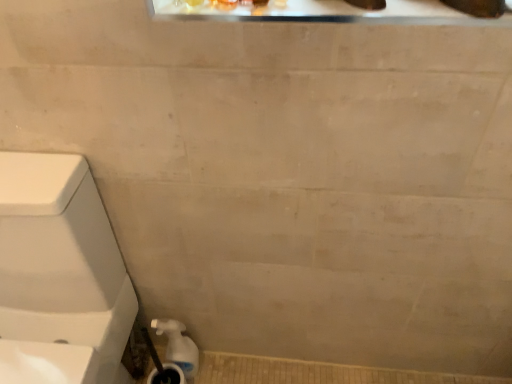
Question: Is white glossy water pipe at lower left aimed at white glossy toilet at left?

Choices:
 (A) no
 (B) yes

Answer: (A)

Question: Is white glossy water pipe at lower left positioned before white glossy toilet at left?

Choices:
 (A) no
 (B) yes

Answer: (A)

Question: Is white glossy water pipe at lower left completely or partially outside of white glossy toilet at left?

Choices:
 (A) no
 (B) yes

Answer: (B)

Question: Does white glossy water pipe at lower left appear on the left side of white glossy toilet at left?

Choices:
 (A) yes
 (B) no

Answer: (B)

Question: From a real-world perspective, is white glossy water pipe at lower left under white glossy toilet at left?

Choices:
 (A) yes
 (B) no

Answer: (A)

Question: Is white glossy water pipe at lower left surrounding white glossy toilet at left?

Choices:
 (A) yes
 (B) no

Answer: (B)

Question: Is white glossy water pipe at lower left at the back of white glossy toilet at left?

Choices:
 (A) yes
 (B) no

Answer: (B)

Question: Is white glossy toilet at left at the right side of white glossy water pipe at lower left?

Choices:
 (A) no
 (B) yes

Answer: (A)

Question: From the image's perspective, is white glossy toilet at left on white glossy water pipe at lower left?

Choices:
 (A) no
 (B) yes

Answer: (B)

Question: From a real-world perspective, is white glossy toilet at left over white glossy water pipe at lower left?

Choices:
 (A) no
 (B) yes

Answer: (B)

Question: Is white glossy toilet at left positioned beyond the bounds of white glossy water pipe at lower left?

Choices:
 (A) yes
 (B) no

Answer: (A)

Question: From a real-world perspective, is white glossy toilet at left below white glossy water pipe at lower left?

Choices:
 (A) yes
 (B) no

Answer: (B)

Question: Relative to white glossy toilet at left, is white glossy water pipe at lower left in front or behind?

Choices:
 (A) front
 (B) behind

Answer: (B)